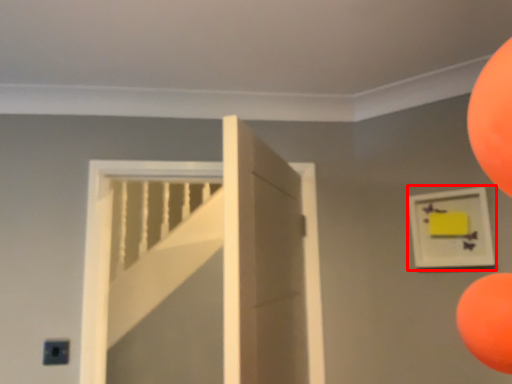
Question: In this image, where is picture frame (annotated by the red box) located relative to door?

Choices:
 (A) left
 (B) right

Answer: (B)